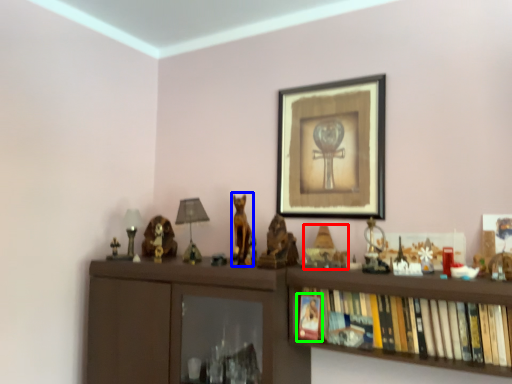
Question: Based on their relative distances, which object is nearer to toy (highlighted by a red box)? Choose from animal (highlighted by a blue box) and book (highlighted by a green box).

Choices:
 (A) animal
 (B) book

Answer: (B)